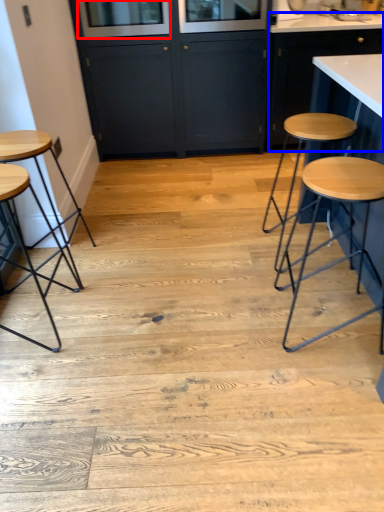
Question: Which of the following is the farthest to the observer, window screen (highlighted by a red box) or cabinetry (highlighted by a blue box)?

Choices:
 (A) window screen
 (B) cabinetry

Answer: (B)